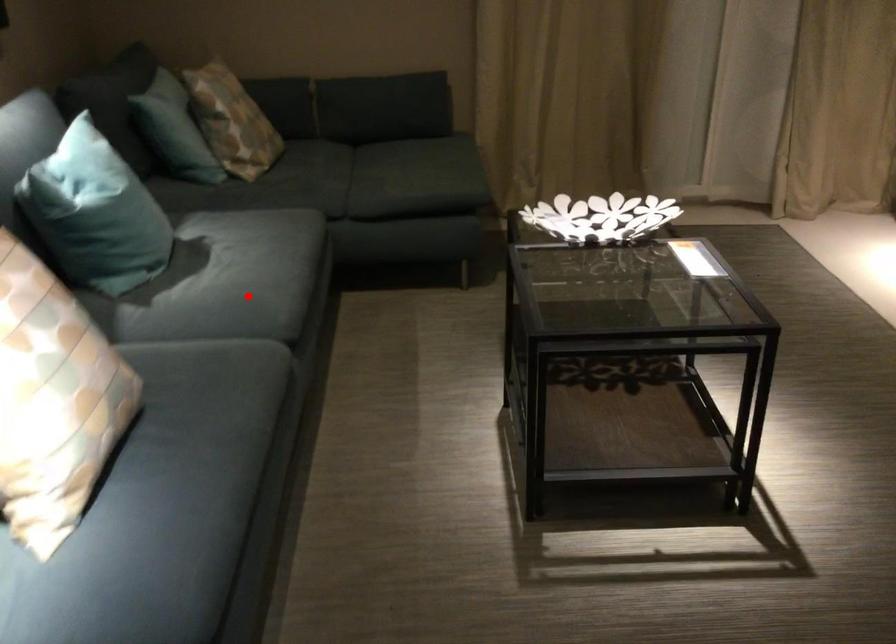
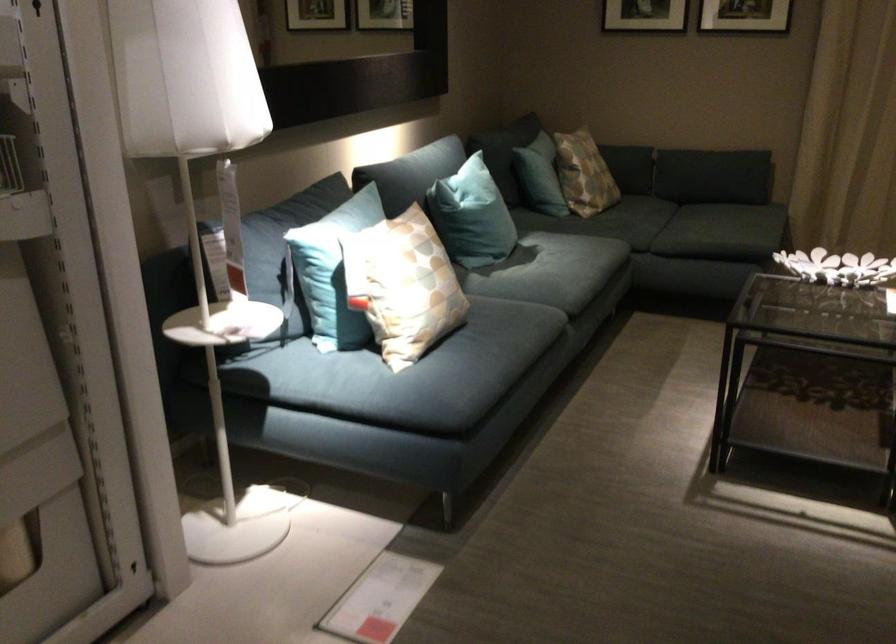
Question: I am providing you with two images of the same scene from different viewpoints. A red point is marked on the first image. Is the red point's position out of view in image 2?

Choices:
 (A) Yes
 (B) No

Answer: (B)